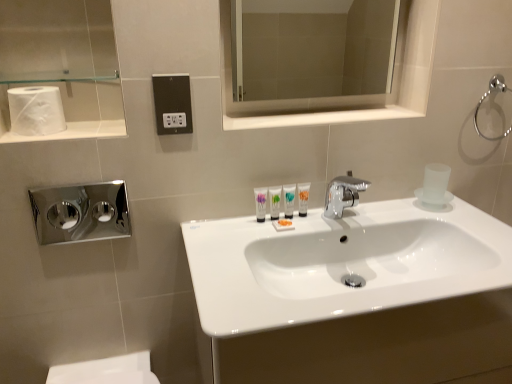
Question: Is chrome metallic towel ring at upper right thinner than white matte toilet paper at upper left?

Choices:
 (A) no
 (B) yes

Answer: (B)

Question: Is chrome metallic towel ring at upper right bigger than white matte toilet paper at upper left?

Choices:
 (A) yes
 (B) no

Answer: (B)

Question: Is chrome metallic towel ring at upper right outside of white matte toilet paper at upper left?

Choices:
 (A) yes
 (B) no

Answer: (A)

Question: Is chrome metallic towel ring at upper right to the left of white matte toilet paper at upper left from the viewer's perspective?

Choices:
 (A) no
 (B) yes

Answer: (A)

Question: Considering the relative sizes of chrome metallic towel ring at upper right and white matte toilet paper at upper left in the image provided, is chrome metallic towel ring at upper right taller than white matte toilet paper at upper left?

Choices:
 (A) no
 (B) yes

Answer: (B)

Question: Is white glossy sink at center inside the boundaries of white glossy medicine cabinet at upper center, or outside?

Choices:
 (A) inside
 (B) outside

Answer: (B)

Question: From a real-world perspective, relative to white glossy medicine cabinet at upper center, is white glossy sink at center vertically above or below?

Choices:
 (A) above
 (B) below

Answer: (B)

Question: In the image, is white glossy sink at center on the left side or the right side of white glossy medicine cabinet at upper center?

Choices:
 (A) left
 (B) right

Answer: (B)

Question: In terms of width, does white glossy sink at center look wider or thinner when compared to white glossy medicine cabinet at upper center?

Choices:
 (A) thin
 (B) wide

Answer: (B)

Question: In terms of height, does black plastic outlet at center look taller or shorter compared to white glossy sink at center?

Choices:
 (A) tall
 (B) short

Answer: (B)

Question: From the image's perspective, is black plastic outlet at center located above or below white glossy sink at center?

Choices:
 (A) above
 (B) below

Answer: (A)

Question: Choose the correct answer: Is black plastic outlet at center inside white glossy sink at center or outside it?

Choices:
 (A) inside
 (B) outside

Answer: (B)

Question: Considering the positions of point (161, 125) and point (420, 243), is point (161, 125) closer or farther from the camera than point (420, 243)?

Choices:
 (A) farther
 (B) closer

Answer: (B)

Question: From the image's perspective, is white glossy sink at center located above or below chrome metallic towel ring at upper right?

Choices:
 (A) below
 (B) above

Answer: (A)

Question: Is white glossy sink at center spatially inside chrome metallic towel ring at upper right, or outside of it?

Choices:
 (A) inside
 (B) outside

Answer: (B)